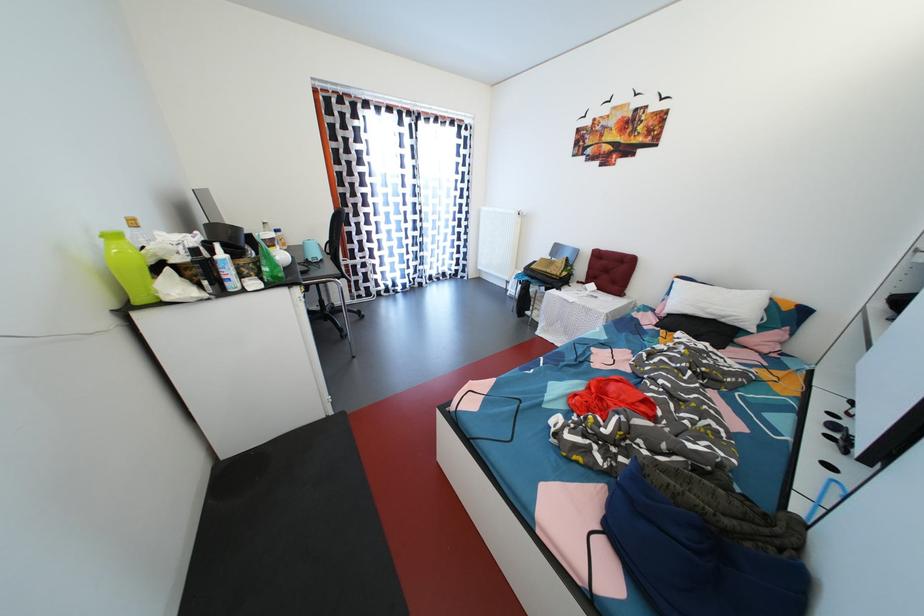
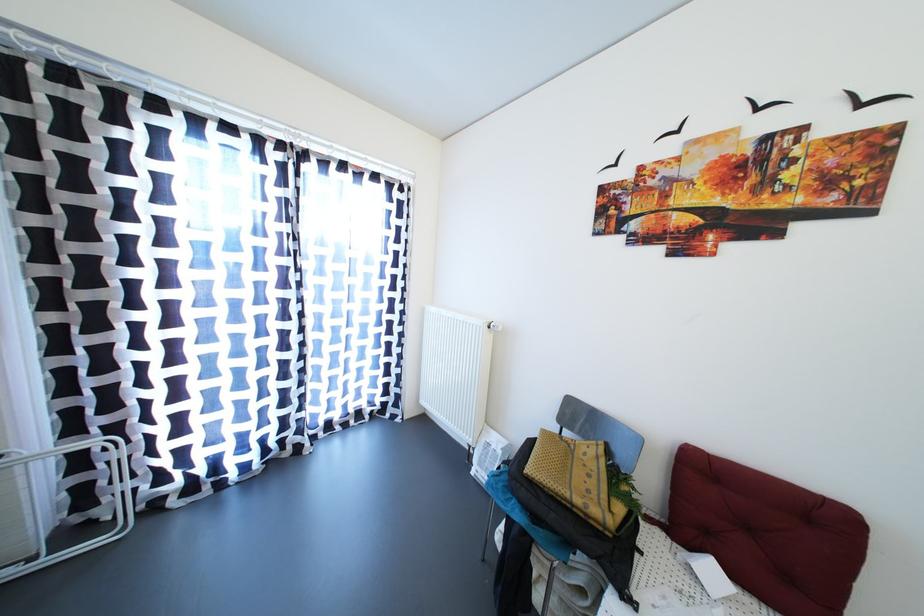
Locate, in the second image, the point that corresponds to point (592, 285) in the first image.

(677, 525)